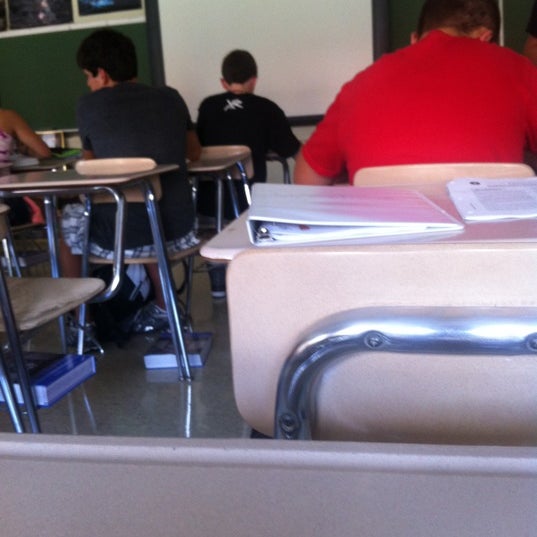
Where is `chairs with no students in them`? This screenshot has width=537, height=537. chairs with no students in them is located at coordinates (451, 268), (30, 296).